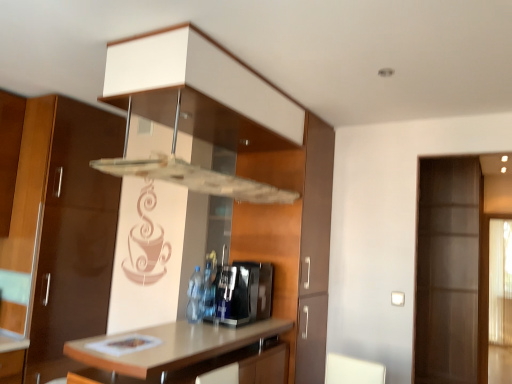
Question: Is translucent plastic bottle at center not inside sleek metallic coffee machine at center?

Choices:
 (A) no
 (B) yes

Answer: (A)

Question: From a real-world perspective, is translucent plastic bottle at center over sleek metallic coffee machine at center?

Choices:
 (A) yes
 (B) no

Answer: (B)

Question: Considering the relative sizes of translucent plastic bottle at center and sleek metallic coffee machine at center in the image provided, is translucent plastic bottle at center smaller than sleek metallic coffee machine at center?

Choices:
 (A) yes
 (B) no

Answer: (A)

Question: Considering the relative sizes of translucent plastic bottle at center and sleek metallic coffee machine at center in the image provided, is translucent plastic bottle at center wider than sleek metallic coffee machine at center?

Choices:
 (A) no
 (B) yes

Answer: (A)

Question: Can sleek metallic coffee machine at center be found inside translucent plastic bottle at center?

Choices:
 (A) yes
 (B) no

Answer: (B)

Question: Is transparent glass door at right inside the boundaries of sleek metallic coffee machine at center, or outside?

Choices:
 (A) inside
 (B) outside

Answer: (B)

Question: From the image's perspective, is transparent glass door at right located above or below sleek metallic coffee machine at center?

Choices:
 (A) below
 (B) above

Answer: (A)

Question: Is point (443, 352) closer or farther from the camera than point (243, 292)?

Choices:
 (A) closer
 (B) farther

Answer: (B)

Question: In terms of size, does transparent glass door at right appear bigger or smaller than sleek metallic coffee machine at center?

Choices:
 (A) small
 (B) big

Answer: (B)

Question: Is sleek metallic coffee machine at center taller or shorter than light brown laminate countertop at center?

Choices:
 (A) short
 (B) tall

Answer: (A)

Question: From the image's perspective, is sleek metallic coffee machine at center positioned above or below light brown laminate countertop at center?

Choices:
 (A) above
 (B) below

Answer: (A)

Question: Considering their positions, is sleek metallic coffee machine at center located in front of or behind light brown laminate countertop at center?

Choices:
 (A) behind
 (B) front

Answer: (A)

Question: From a real-world perspective, is sleek metallic coffee machine at center above or below light brown laminate countertop at center?

Choices:
 (A) below
 (B) above

Answer: (B)

Question: Considering the positions of sleek metallic coffee machine at center and translucent plastic bottle at center in the image, is sleek metallic coffee machine at center taller or shorter than translucent plastic bottle at center?

Choices:
 (A) short
 (B) tall

Answer: (B)

Question: From the image's perspective, is sleek metallic coffee machine at center positioned above or below translucent plastic bottle at center?

Choices:
 (A) above
 (B) below

Answer: (B)